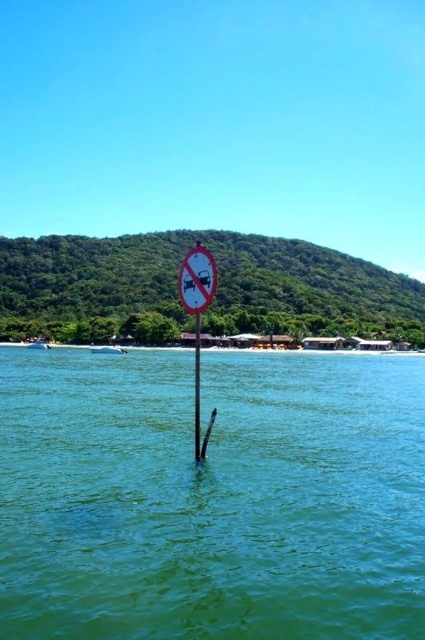
Who is lower down, green water at center or smooth wood pole at center?

Positioned lower is green water at center.

What do you see at coordinates (212, 497) in the screenshot? I see `green water at center` at bounding box center [212, 497].

Between point (27, 520) and point (195, 339), which one is positioned in front?

Point (27, 520) is in front.

Where is `green water at center`? Image resolution: width=425 pixels, height=640 pixels. green water at center is located at coordinates pyautogui.click(x=212, y=497).